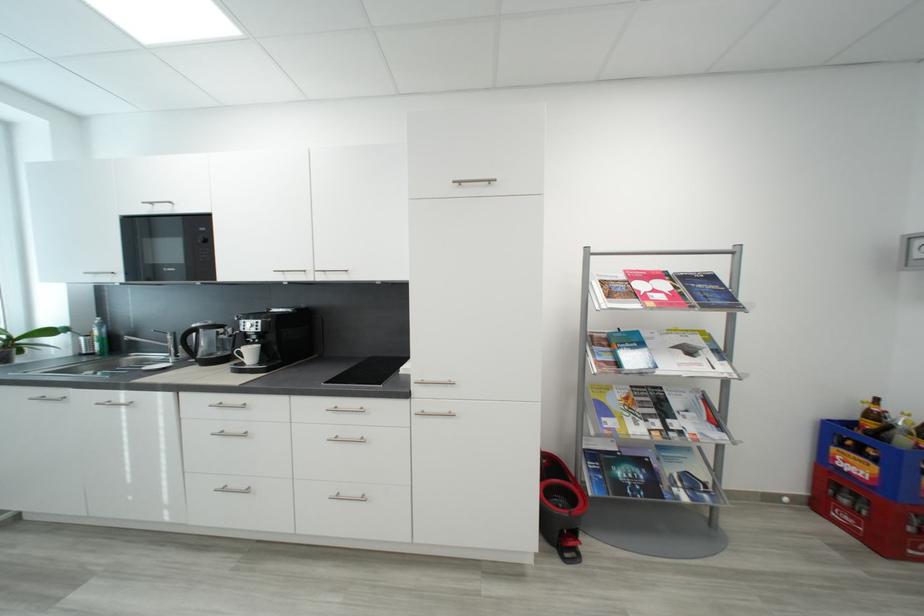
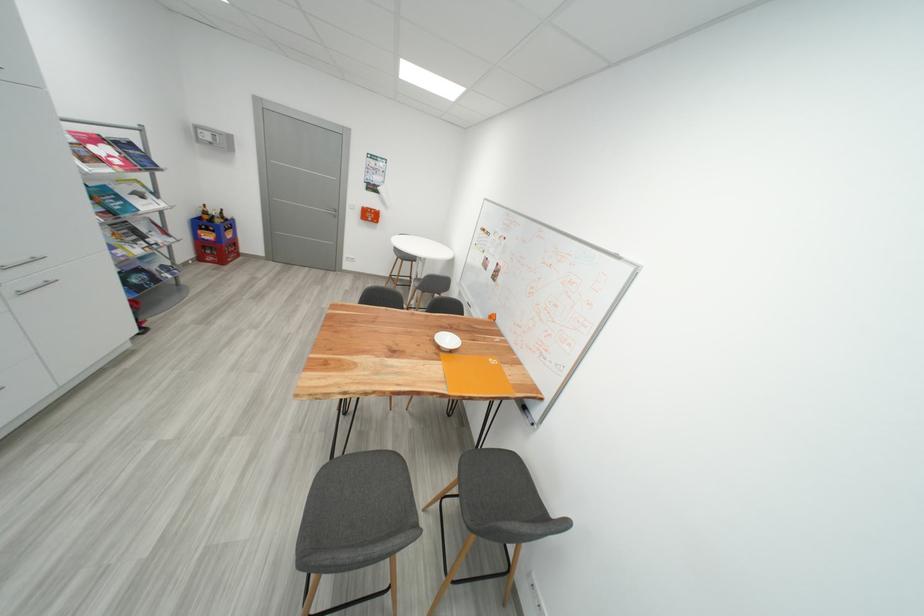
Where in the second image is the point corresponding to (640,296) from the first image?

(104, 161)